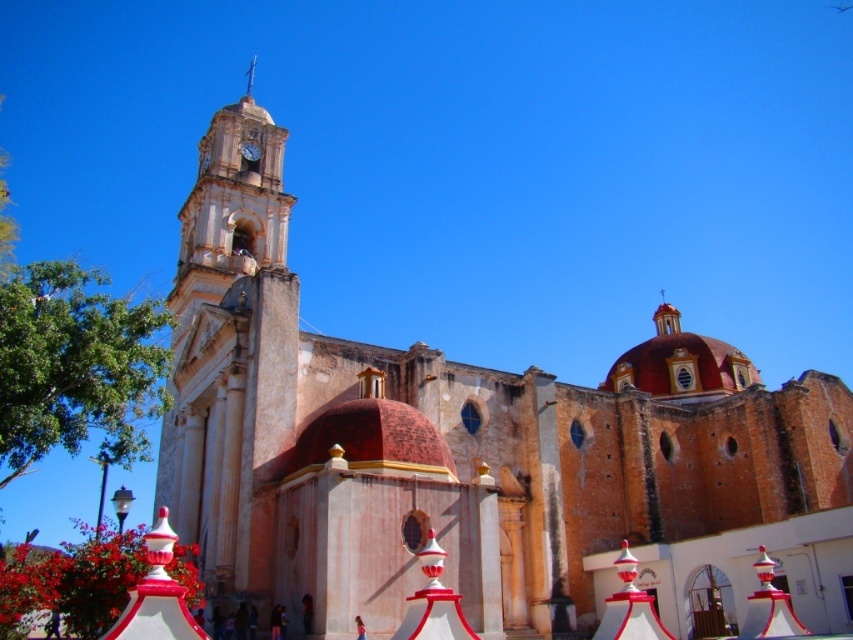
You are standing at the point labeled point (230, 353) in the image. What architectural feature are you facing?

The point labeled point (230, 353) corresponds to the stone clock tower at left.

You are standing directly in front of the central bell tower of the historic church. Looking up, you notice the metallic clock at upper center. Based on its position, can you estimate where it is located relative to the tower?

The metallic clock at upper center is positioned at coordinates approximately 0.237 along the horizontal axis and 0.294 along the vertical axis relative to the tower, placing it slightly to the left and lower portion of the tower.